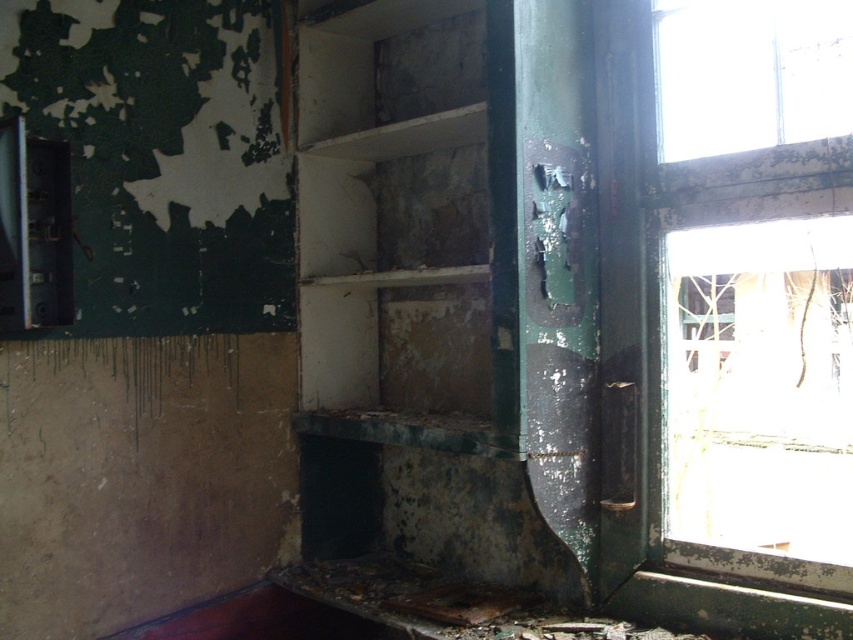
You are a maintenance worker inspecting the abandoned room. You need to access the green painted wood window at right to check its condition. Is the white matte shelf at center blocking your direct path to the window?

The green painted wood window at right is behind the white matte shelf at center, so the white matte shelf at center is blocking the direct path to the window.

You are an interior designer assessing the space for renovation. You need to determine if the white matte shelf at center can be replaced with a larger one. Given the size of the green painted wood window at right, can you infer if there is enough space for a bigger shelf?

The white matte shelf at center is bigger than the green painted wood window at right. Since the current shelf is already larger than the window, there might be sufficient space to accommodate an even larger shelf, provided other structural factors are considered.